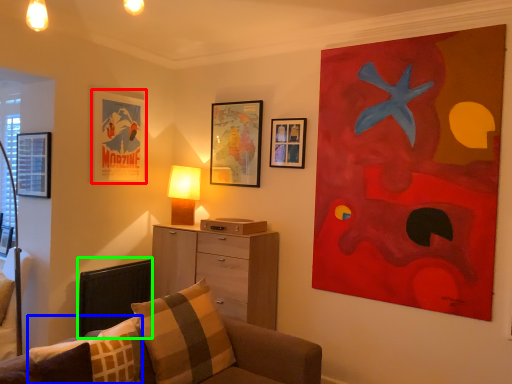
Question: Considering the real-world distances, which object is closest to picture frame (highlighted by a red box)? pillow (highlighted by a blue box) or swivel chair (highlighted by a green box).

Choices:
 (A) pillow
 (B) swivel chair

Answer: (B)